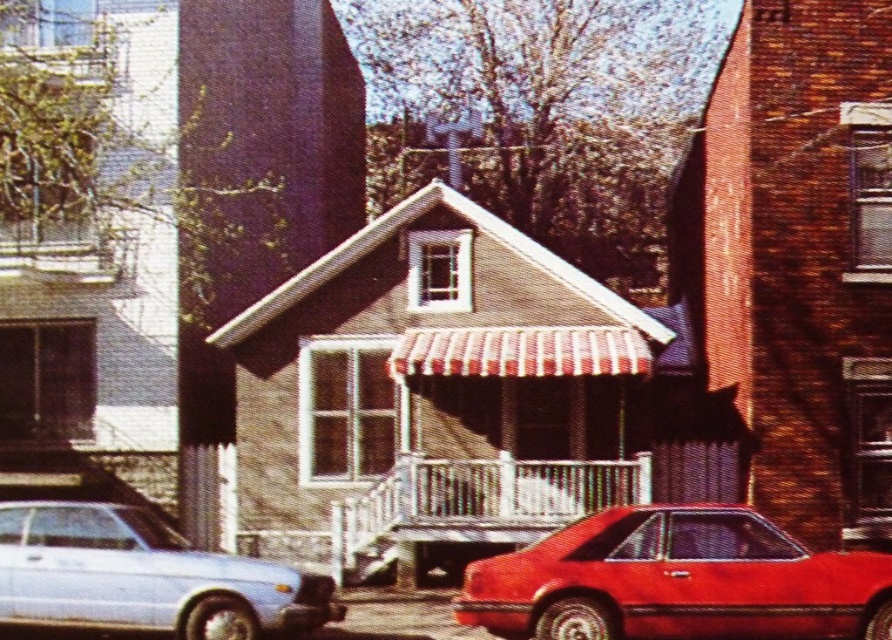
Question: Is shiny red car at lower right further to the viewer compared to matte silver sedan at lower left?

Choices:
 (A) no
 (B) yes

Answer: (A)

Question: In this image, where is shiny red car at lower right located relative to matte silver sedan at lower left?

Choices:
 (A) below
 (B) above

Answer: (B)

Question: Which object appears farthest from the camera in this image?

Choices:
 (A) matte silver sedan at lower left
 (B) shiny red car at lower right

Answer: (A)

Question: Which point appears closest to the camera in this image?

Choices:
 (A) (579, 596)
 (B) (89, 609)

Answer: (A)

Question: Can you confirm if shiny red car at lower right is positioned above matte silver sedan at lower left?

Choices:
 (A) no
 (B) yes

Answer: (B)